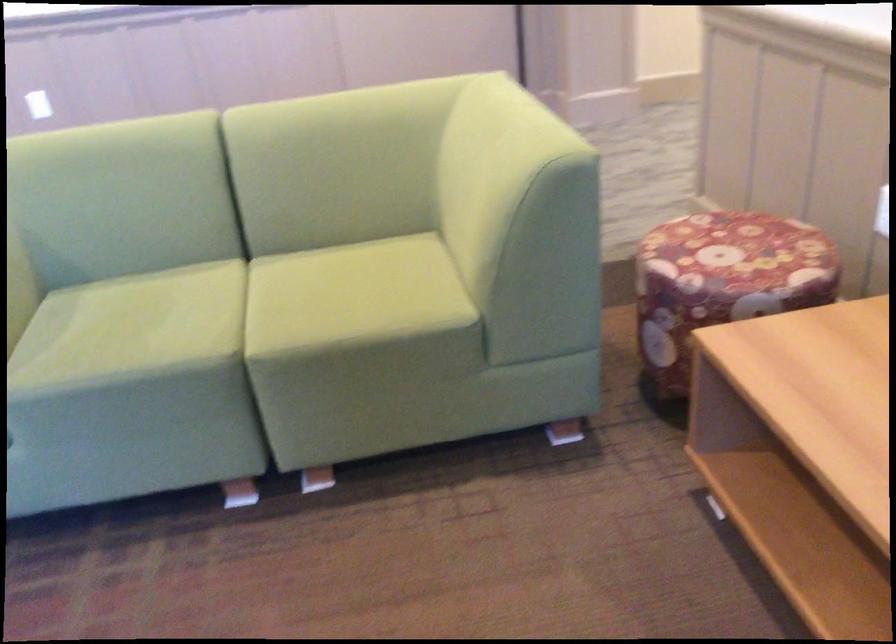
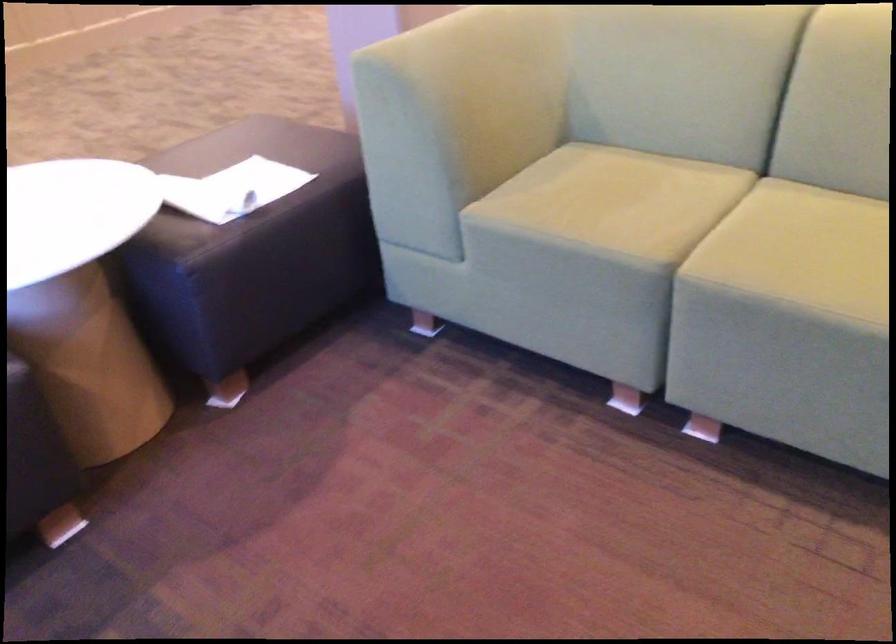
In the second image, find the point that corresponds to [346,285] in the first image.

(837, 238)